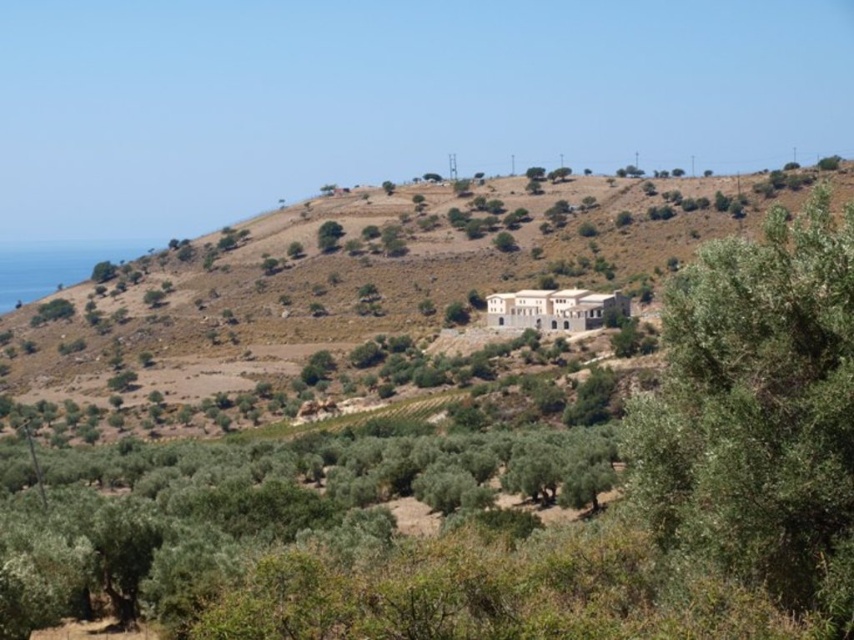
Image resolution: width=854 pixels, height=640 pixels. Describe the element at coordinates (757, 412) in the screenshot. I see `green leafy tree at center-right` at that location.

Who is positioned more to the right, green leafy tree at center-right or green leafy tree at upper center?

green leafy tree at center-right

Where is `green leafy tree at center-right`? The image size is (854, 640). green leafy tree at center-right is located at coordinates (757, 412).

Which is more to the left, beige stone building at center or green leafy tree at center-right?

From the viewer's perspective, beige stone building at center appears more on the left side.

Is beige stone building at center wider than green leafy tree at center-right?

Yes.

Between point (92, 381) and point (788, 301), which one is positioned in front?

Point (788, 301) is in front.

This screenshot has width=854, height=640. What are the coordinates of `beige stone building at center` in the screenshot? It's located at (364, 305).

Is beige stone building at center closer to the viewer compared to green leafy tree at upper center?

Yes, it is.

Is beige stone building at center thinner than green leafy tree at upper center?

Incorrect, beige stone building at center's width is not less than green leafy tree at upper center's.

Between point (633, 225) and point (336, 234), which one is positioned behind?

The point (336, 234) is behind.

Locate an element on the screen. The height and width of the screenshot is (640, 854). beige stone building at center is located at coordinates (364, 305).